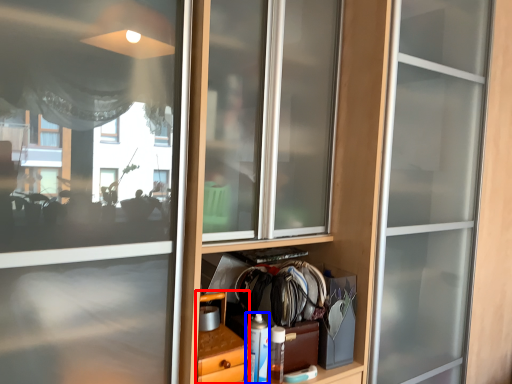
Question: Among these objects, which one is farthest to the camera, cabinetry (highlighted by a red box) or bottle (highlighted by a blue box)?

Choices:
 (A) cabinetry
 (B) bottle

Answer: (B)